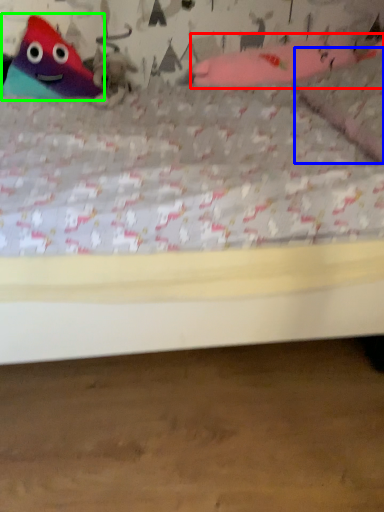
Question: Estimate the real-world distances between objects in this image. Which object is farther from toy (highlighted by a red box), pillow (highlighted by a blue box) or toy (highlighted by a green box)?

Choices:
 (A) pillow
 (B) toy

Answer: (B)